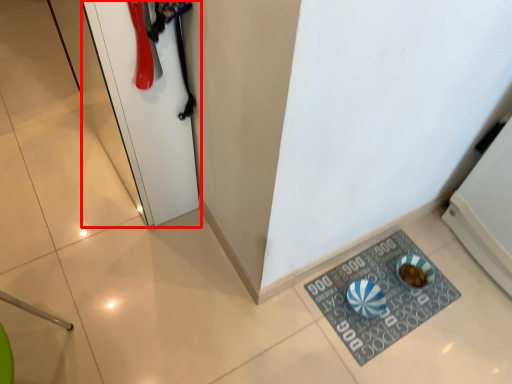
Question: From the image's perspective, considering the relative positions of door (annotated by the red box) and doormat in the image provided, where is door (annotated by the red box) located with respect to the staircase?

Choices:
 (A) above
 (B) below

Answer: (A)